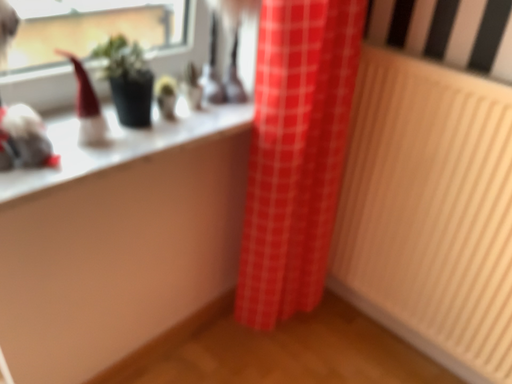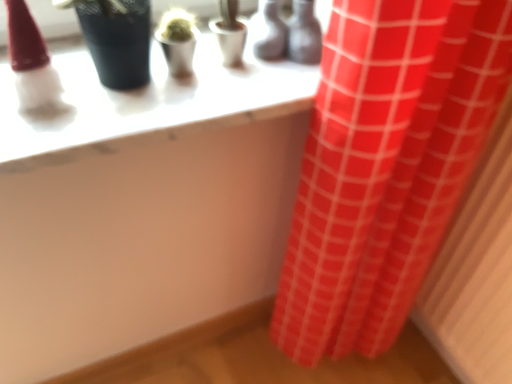
Question: Which way did the camera rotate in the video?

Choices:
 (A) rotated right
 (B) rotated left

Answer: (B)